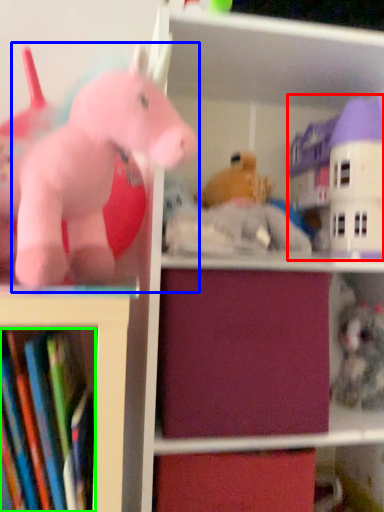
Question: Which object is the closest to the toy (highlighted by a red box)? Choose among these: toy (highlighted by a blue box) or book (highlighted by a green box).

Choices:
 (A) toy
 (B) book

Answer: (A)